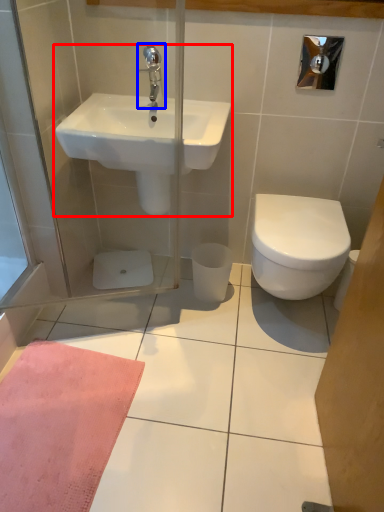
Question: Which object appears farthest to the camera in this image, sink (highlighted by a red box) or tap (highlighted by a blue box)?

Choices:
 (A) sink
 (B) tap

Answer: (B)